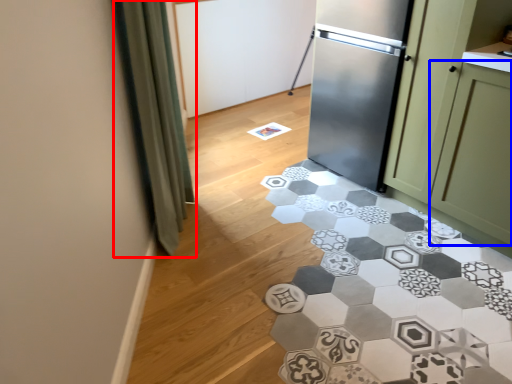
Question: Which point is closer to the camera, curtain (highlighted by a red box) or glass door (highlighted by a blue box)?

Choices:
 (A) curtain
 (B) glass door

Answer: (A)